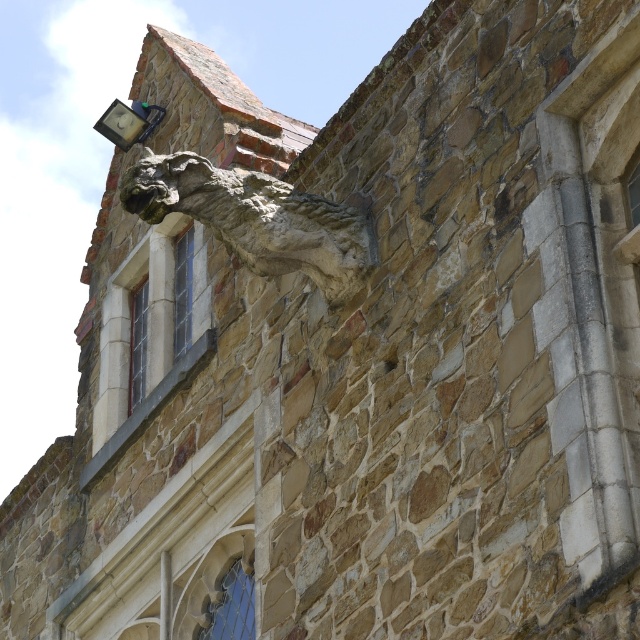
Question: Does stone gargoyle at upper center have a larger size compared to metallic stone gargoyle at upper left?

Choices:
 (A) yes
 (B) no

Answer: (B)

Question: Among these objects, which one is nearest to the camera?

Choices:
 (A) stone gargoyle at upper center
 (B) clear glass window at upper center

Answer: (A)

Question: Which object appears closest to the camera in this image?

Choices:
 (A) clear glass window at center
 (B) clear glass window at upper center

Answer: (A)

Question: Considering the relative positions of stone gargoyle at upper center and metallic stone gargoyle at upper left in the image provided, where is stone gargoyle at upper center located with respect to metallic stone gargoyle at upper left?

Choices:
 (A) above
 (B) below

Answer: (B)

Question: Based on their relative distances, which object is farther from the stone gargoyle at upper center?

Choices:
 (A) clear glass window at lower center
 (B) clear glass window at upper center
 (C) clear glass window at center
 (D) metallic stone gargoyle at upper left

Answer: (D)

Question: Does stone gargoyle at upper center appear on the left side of clear glass window at upper center?

Choices:
 (A) no
 (B) yes

Answer: (A)